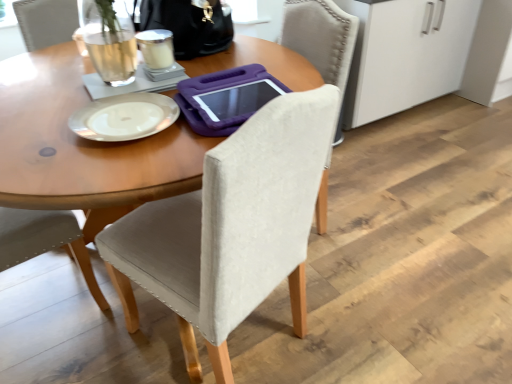
Locate an element on the screen. vacant region below beige fabric chair at center (from a real-world perspective) is located at coordinates (237, 342).